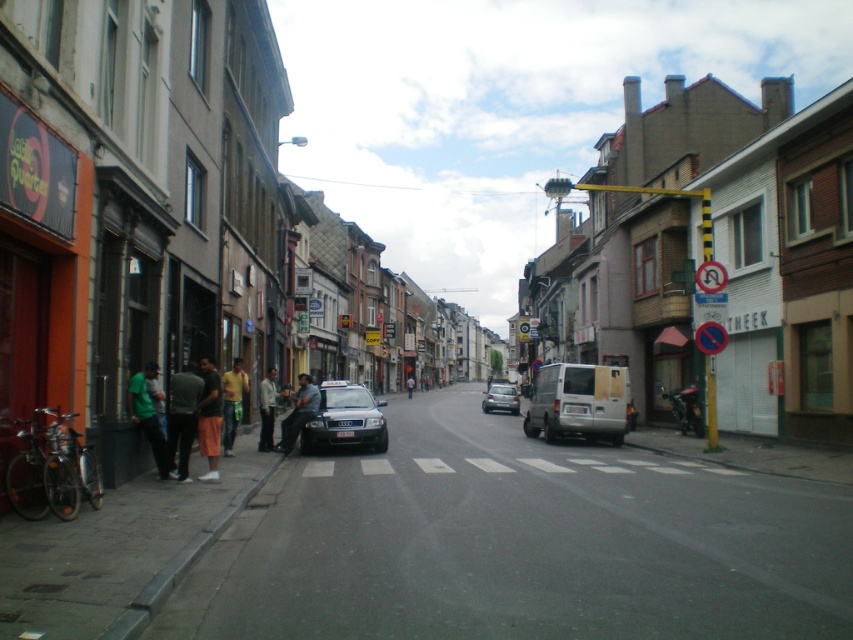
Question: In this image, where is silver metallic van at center located relative to yellow t-shirt at left?

Choices:
 (A) above
 (B) below

Answer: (B)

Question: Which object is farther from the camera taking this photo?

Choices:
 (A) yellow t-shirt at left
 (B) dark blue jeans at center
 (C) matte black car at center

Answer: (C)

Question: Is matte black car at center smaller than dark blue jeans at center?

Choices:
 (A) no
 (B) yes

Answer: (A)

Question: Which is nearer to the light blue jeans at center?

Choices:
 (A) light gray shirt at lower left
 (B) silver metallic van at center

Answer: (B)

Question: Which of the following is the closest to the observer?

Choices:
 (A) (358, 394)
 (B) (244, 390)
 (C) (171, 417)

Answer: (C)

Question: Can you confirm if orange cotton shorts at lower left is positioned to the right of light gray shirt at lower left?

Choices:
 (A) no
 (B) yes

Answer: (B)